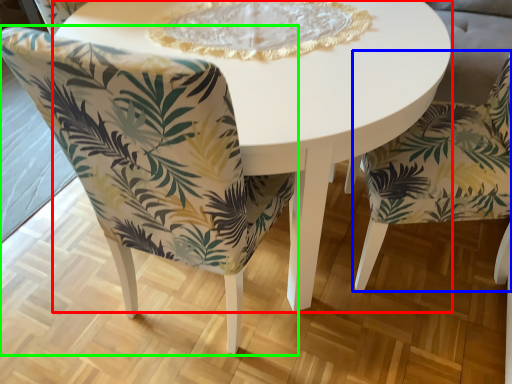
Question: Which object is positioned farthest from coffee table (highlighted by a red box)? Select from chair (highlighted by a blue box) and chair (highlighted by a green box).

Choices:
 (A) chair
 (B) chair

Answer: (A)